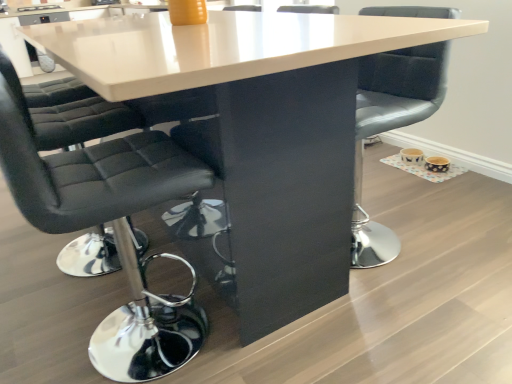
Where is `vacant area that lies to the right of matte gray cushioned chair at center, which appears as the 1th chair when viewed from the right`? vacant area that lies to the right of matte gray cushioned chair at center, which appears as the 1th chair when viewed from the right is located at coordinates (451, 227).